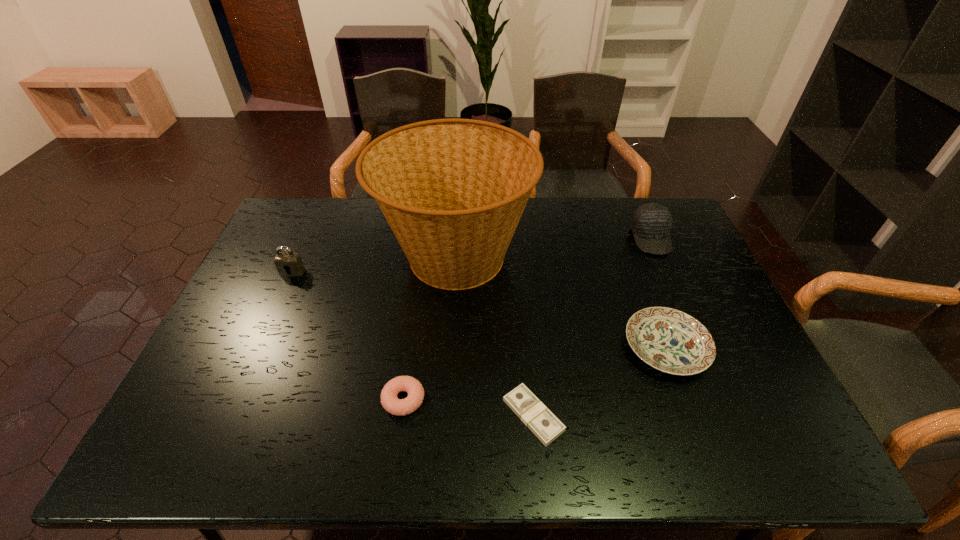
At what (x,y) coordinates should I click in order to perform the action: click on the tallest object. Please return your answer as a coordinate pair (x, y). The width and height of the screenshot is (960, 540). Looking at the image, I should click on (453, 191).

Identify the location of baseball cap. (651, 223).

Find the location of a particular element. This screenshot has width=960, height=540. padlock is located at coordinates (289, 262).

In order to click on plate in this screenshot , I will do `click(669, 340)`.

Identify the location of doughnut. (400, 407).

The height and width of the screenshot is (540, 960). Find the location of `the shortest object`. the shortest object is located at coordinates (532, 412).

Image resolution: width=960 pixels, height=540 pixels. Identify the location of vacant area situated on the left of the basket. (264, 258).

I want to click on blank space located at the front of the baseball cap where the brim is located, so click(683, 309).

Find the location of a particular element. Image resolution: width=960 pixels, height=540 pixels. vacant area situated at the front of the padlock near the keyhole is located at coordinates (270, 323).

Find the location of a particular element. Image resolution: width=960 pixels, height=540 pixels. vacant area located on the left of the plate is located at coordinates (590, 348).